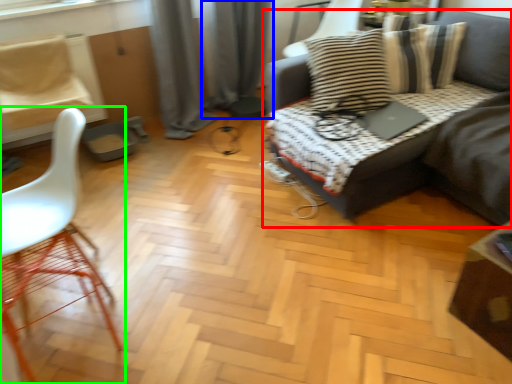
Question: Which is farther away from studio couch (highlighted by a red box)? curtain (highlighted by a blue box) or chair (highlighted by a green box)?

Choices:
 (A) curtain
 (B) chair

Answer: (B)